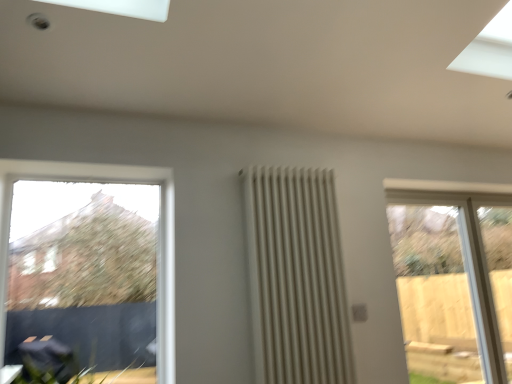
Question: Should I look upward or downward to see clear glass window at left, arranged as the first window when viewed from the front?

Choices:
 (A) down
 (B) up

Answer: (A)

Question: Can you confirm if clear glass door at right, the first window positioned from the back, is shorter than white matte radiator at center?

Choices:
 (A) no
 (B) yes

Answer: (A)

Question: Does clear glass door at right, marked as the first window in a right-to-left arrangement, lie in front of white matte radiator at center?

Choices:
 (A) no
 (B) yes

Answer: (A)

Question: Is clear glass door at right, positioned as the 2th window in left-to-right order, bigger than white matte radiator at center?

Choices:
 (A) no
 (B) yes

Answer: (B)

Question: Considering the relative sizes of clear glass door at right, the second window from the front, and white matte radiator at center in the image provided, is clear glass door at right, the second window from the front, smaller than white matte radiator at center?

Choices:
 (A) yes
 (B) no

Answer: (B)

Question: Is clear glass door at right, the second window from the front, positioned behind white matte radiator at center?

Choices:
 (A) yes
 (B) no

Answer: (A)

Question: From a real-world perspective, is clear glass door at right, marked as the first window in a right-to-left arrangement, beneath white matte radiator at center?

Choices:
 (A) yes
 (B) no

Answer: (A)

Question: Could clear glass door at right, the first window positioned from the back, be considered to be inside white matte radiator at center?

Choices:
 (A) yes
 (B) no

Answer: (B)

Question: From the image's perspective, is white matte radiator at center over clear glass door at right, positioned as the 2th window in left-to-right order?

Choices:
 (A) no
 (B) yes

Answer: (B)

Question: Does white matte radiator at center have a lesser width compared to clear glass door at right, the second window from the front?

Choices:
 (A) no
 (B) yes

Answer: (B)

Question: From the image's perspective, does white matte radiator at center appear lower than clear glass door at right, positioned as the 2th window in left-to-right order?

Choices:
 (A) yes
 (B) no

Answer: (B)

Question: Does white matte radiator at center have a greater width compared to clear glass door at right, marked as the first window in a right-to-left arrangement?

Choices:
 (A) no
 (B) yes

Answer: (A)

Question: From a real-world perspective, is white matte radiator at center located beneath clear glass door at right, marked as the first window in a right-to-left arrangement?

Choices:
 (A) yes
 (B) no

Answer: (B)

Question: Considering the relative sizes of white matte radiator at center and clear glass window at left, the 2th window when ordered from right to left, in the image provided, is white matte radiator at center smaller than clear glass window at left, the 2th window when ordered from right to left,?

Choices:
 (A) no
 (B) yes

Answer: (A)